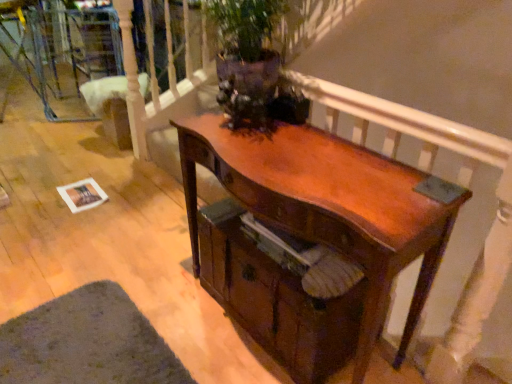
Question: Is point (241, 324) positioned closer to the camera than point (96, 355)?

Choices:
 (A) closer
 (B) farther

Answer: (B)

Question: Is shiny brown drawer at center taller or shorter than green felt mat at lower left?

Choices:
 (A) short
 (B) tall

Answer: (B)

Question: Which object is positioned closest to the wooden armchair at center?

Choices:
 (A) shiny brown drawer at center
 (B) shiny brown wood desk at center
 (C) green felt mat at lower left

Answer: (C)

Question: Estimate the real-world distances between objects in this image. Which object is closer to the shiny brown wood desk at center?

Choices:
 (A) green felt mat at lower left
 (B) shiny brown drawer at center
 (C) wooden armchair at center

Answer: (B)